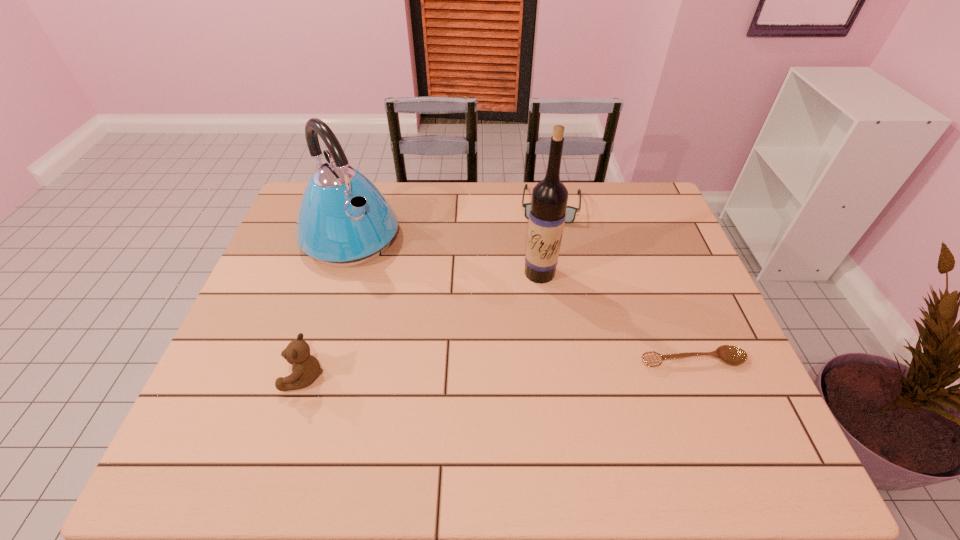
This screenshot has height=540, width=960. I want to click on blank space located 0.180m at the spout of the second tallest object, so click(x=409, y=301).

The height and width of the screenshot is (540, 960). Identify the location of free location located 0.050m at the spout of the second tallest object. 384,274.

This screenshot has height=540, width=960. Identify the location of free location located on the face of the spectacles. (542, 284).

You are a GUI agent. You are given a task and a screenshot of the screen. Output one action in this format:
    pyautogui.click(x=<x>, y=<y>)
    Task: Click on the vacant space located 0.150m on the face of the spectacles
    This screenshot has width=960, height=540.
    Given the screenshot: What is the action you would take?
    pyautogui.click(x=545, y=255)

Where is `free point located on the face of the spectacles`? free point located on the face of the spectacles is located at coordinates (545, 260).

Find the location of `vacant area situated 0.350m on the label of the wine bottle`. vacant area situated 0.350m on the label of the wine bottle is located at coordinates (492, 387).

Where is `vacant space located 0.120m on the label of the wine bottle`? Image resolution: width=960 pixels, height=540 pixels. vacant space located 0.120m on the label of the wine bottle is located at coordinates (522, 314).

I want to click on vacant space located on the label of the wine bottle, so click(x=518, y=323).

At what (x,y) coordinates should I click in order to perform the action: click on kettle that is positioned at the far edge. Please return your answer as a coordinate pair (x, y). Looking at the image, I should click on (343, 220).

This screenshot has width=960, height=540. Identify the location of spectacles at the far edge. (571, 211).